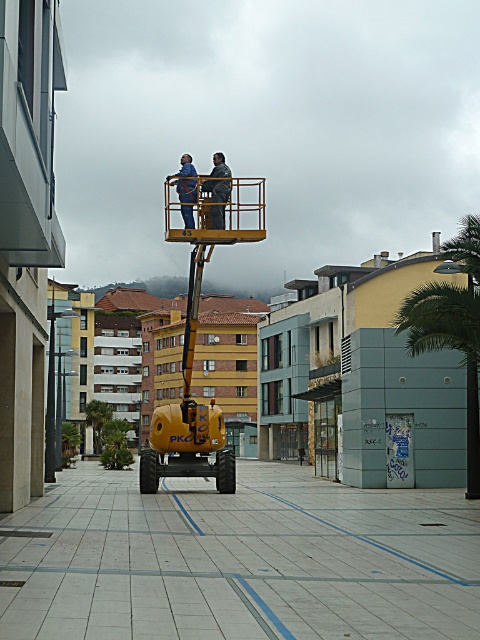
Consider the image. You are standing at the camera position and want to reach point (79, 616). The yellow telescopic boom lift PKO 45 can extend up to 45 feet. Can the lift reach the point?

The distance of point (79, 616) from camera is 26.01 feet. Since the lift can extend up to 45 feet, it can reach the point.

You are standing at the point with coordinates point (478, 424) and want to walk to the point with coordinates point (158, 460). Is there a clear path between these two points?

Point (158, 460) is behind point (478, 424), so there is no clear path between them.

You are a delivery person trying to navigate through the construction area shown in the image. You need to deliver a package to the address located behind the green leafy palm tree at right. Can you drive your delivery van, which is 2 meters tall, under the yellow rubber construction vehicle at center without hitting it?

The yellow rubber construction vehicle at center is below the green leafy palm tree at right, so the delivery van can safely pass under the yellow rubber construction vehicle at center to reach the address behind the green leafy palm tree at right since the vehicle is positioned above the palm tree and the van is 2 meters tall which is likely under the vehicle height.